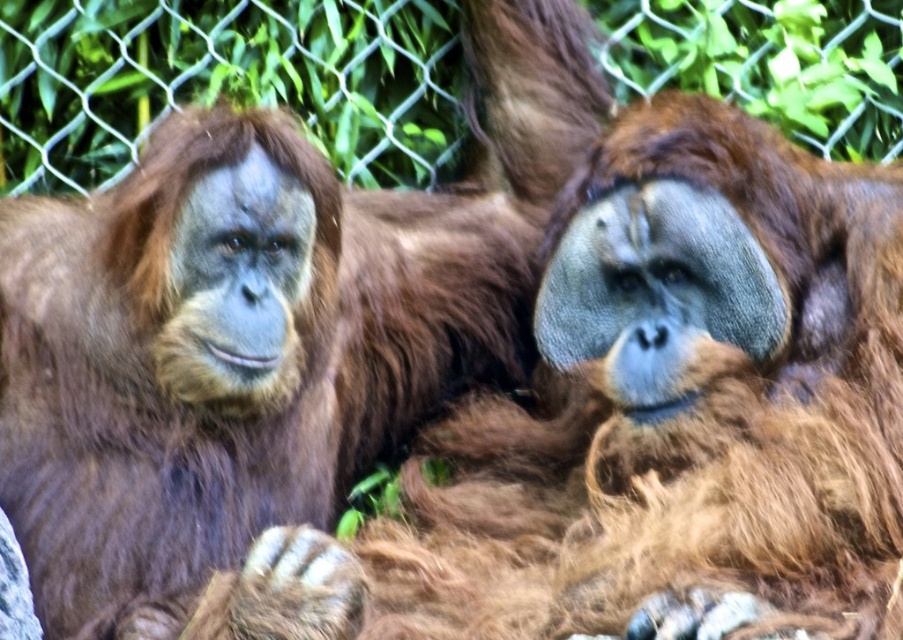
Question: Can you confirm if brown furry orangutan at center is positioned to the left of wire mesh fence at upper center?

Choices:
 (A) yes
 (B) no

Answer: (B)

Question: Which point appears farthest from the camera in this image?

Choices:
 (A) (213, 332)
 (B) (436, 125)

Answer: (B)

Question: In this image, where is brown furry orangutan at center located relative to wire mesh fence at upper center?

Choices:
 (A) above
 (B) below

Answer: (B)

Question: Is brown furry orangutan at center positioned behind wire mesh fence at upper center?

Choices:
 (A) yes
 (B) no

Answer: (B)